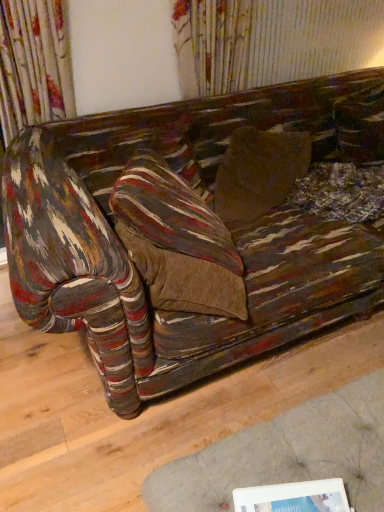
Question: Could white plastic picture frame at lower right be considered to be inside textured multicolored fabric couch at center?

Choices:
 (A) yes
 (B) no

Answer: (B)

Question: Could you tell me if textured multicolored fabric couch at center is turned towards white plastic picture frame at lower right?

Choices:
 (A) no
 (B) yes

Answer: (A)

Question: From the image's perspective, does textured multicolored fabric couch at center appear lower than white plastic picture frame at lower right?

Choices:
 (A) no
 (B) yes

Answer: (A)

Question: Can you confirm if textured multicolored fabric couch at center is taller than white plastic picture frame at lower right?

Choices:
 (A) yes
 (B) no

Answer: (B)

Question: From a real-world perspective, is textured multicolored fabric couch at center on white plastic picture frame at lower right?

Choices:
 (A) yes
 (B) no

Answer: (B)

Question: Considering the relative positions of textured multicolored fabric couch at center and white plastic picture frame at lower right in the image provided, is textured multicolored fabric couch at center to the right of white plastic picture frame at lower right from the viewer's perspective?

Choices:
 (A) no
 (B) yes

Answer: (B)

Question: Is white plastic picture frame at lower right not within textured multicolored fabric couch at center?

Choices:
 (A) no
 (B) yes

Answer: (B)

Question: Is white plastic picture frame at lower right aimed at textured multicolored fabric couch at center?

Choices:
 (A) yes
 (B) no

Answer: (B)

Question: From a real-world perspective, is white plastic picture frame at lower right over textured multicolored fabric couch at center?

Choices:
 (A) no
 (B) yes

Answer: (B)

Question: Can you confirm if white plastic picture frame at lower right is bigger than textured multicolored fabric couch at center?

Choices:
 (A) no
 (B) yes

Answer: (A)

Question: Is white plastic picture frame at lower right positioned far away from textured multicolored fabric couch at center?

Choices:
 (A) yes
 (B) no

Answer: (B)

Question: Does white plastic picture frame at lower right have a lesser height compared to textured multicolored fabric couch at center?

Choices:
 (A) yes
 (B) no

Answer: (B)

Question: Is textured multicolored fabric couch at center bigger or smaller than white plastic picture frame at lower right?

Choices:
 (A) small
 (B) big

Answer: (B)